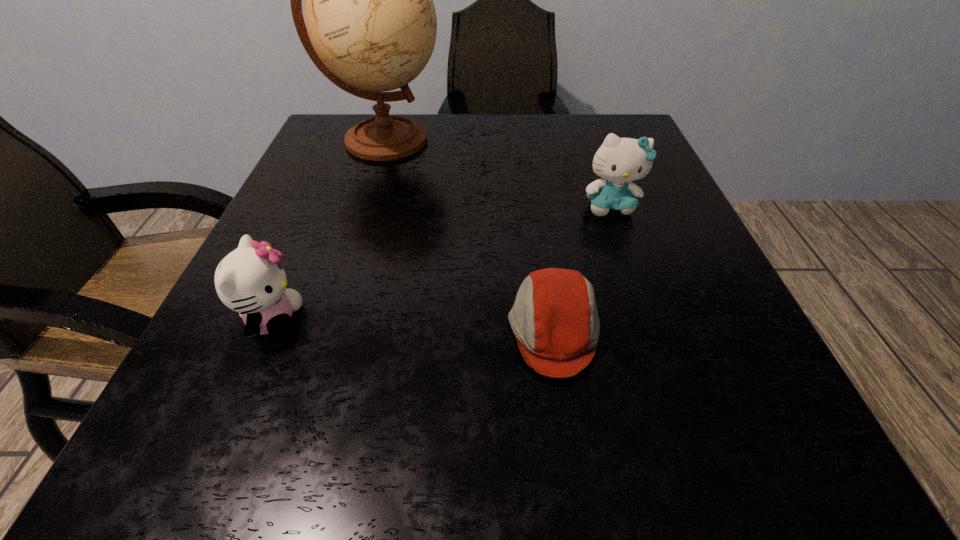
Find the location of a particular element. The height and width of the screenshot is (540, 960). free space at the left edge is located at coordinates (298, 169).

The height and width of the screenshot is (540, 960). I want to click on vacant space at the right edge of the desktop, so click(664, 176).

You are a GUI agent. You are given a task and a screenshot of the screen. Output one action in this format:
    pyautogui.click(x=<x>, y=<y>)
    Task: Click on the vacant space at the far right corner of the desktop
    The width and height of the screenshot is (960, 540).
    Given the screenshot: What is the action you would take?
    pyautogui.click(x=590, y=129)

Image resolution: width=960 pixels, height=540 pixels. Find the location of `free point at the near right corner`. free point at the near right corner is located at coordinates point(774,445).

Where is `vacant space that is in between the globe and the cap`? The image size is (960, 540). vacant space that is in between the globe and the cap is located at coordinates (469, 235).

Identify the location of free space between the farther kitten and the globe. (497, 173).

This screenshot has width=960, height=540. Find the location of `vacant area that lies between the left kitten and the tallest object`. vacant area that lies between the left kitten and the tallest object is located at coordinates (328, 230).

Where is `empty location between the shortest object and the farthest object`? The height and width of the screenshot is (540, 960). empty location between the shortest object and the farthest object is located at coordinates (469, 235).

You are a GUI agent. You are given a task and a screenshot of the screen. Output one action in this format:
    pyautogui.click(x=<x>, y=<y>)
    Task: Click on the free area in between the nearer kitten and the farthest object
    This screenshot has height=540, width=960.
    Given the screenshot: What is the action you would take?
    click(328, 230)

Where is `free space between the tallest object and the cap`? The image size is (960, 540). free space between the tallest object and the cap is located at coordinates [469, 235].